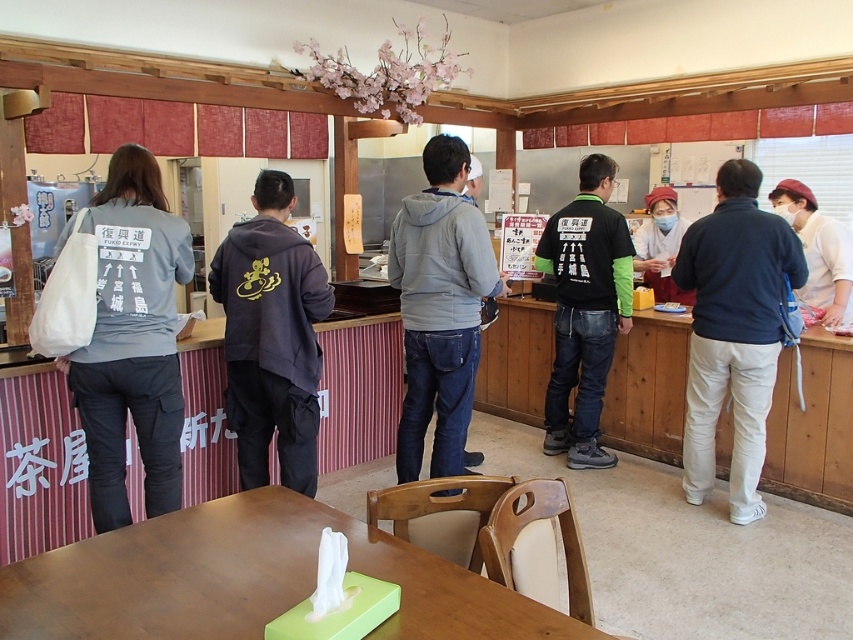
Question: Does green matte table at lower center have a larger size compared to gray fleece jacket at center?

Choices:
 (A) yes
 (B) no

Answer: (B)

Question: Which object is the farthest from the green matte table at lower center?

Choices:
 (A) gray cotton jacket at left
 (B) gray fleece jacket at center
 (C) black matte jacket at center

Answer: (C)

Question: Is green matte table at lower center to the left of gray cotton jacket at left from the viewer's perspective?

Choices:
 (A) yes
 (B) no

Answer: (B)

Question: Among these points, which one is nearest to the camera?

Choices:
 (A) (434, 582)
 (B) (111, 269)

Answer: (A)

Question: Which object is farther from the camera taking this photo?

Choices:
 (A) dark gray hoodie at center
 (B) gray fleece jacket at center

Answer: (B)

Question: Does dark gray hoodie at center appear under light beige fabric apron at right?

Choices:
 (A) yes
 (B) no

Answer: (A)